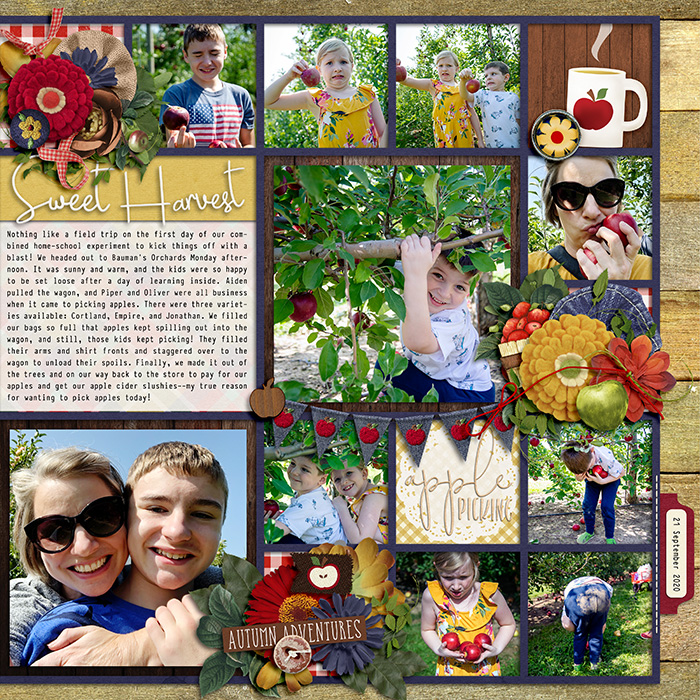
Where is `mug`? This screenshot has width=700, height=700. mug is located at coordinates (614, 74).